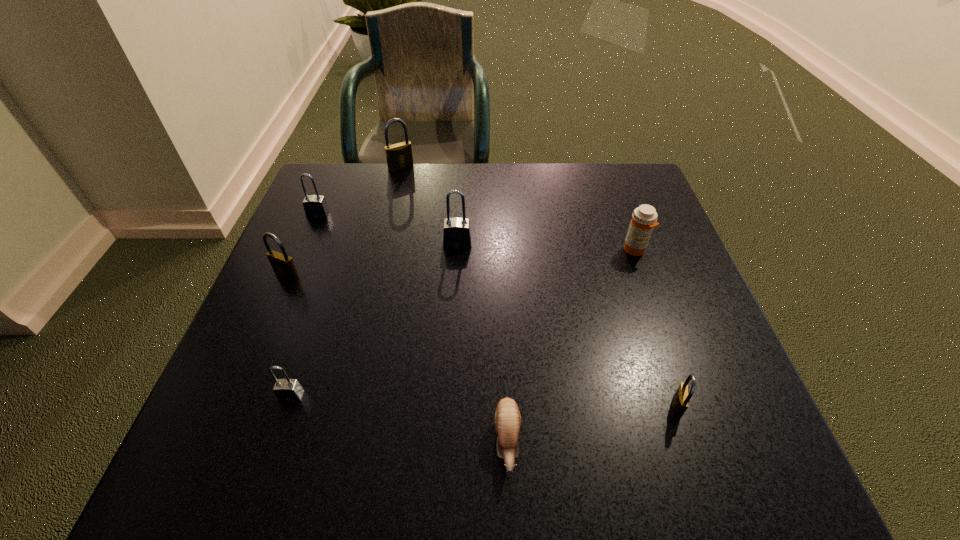
The image size is (960, 540). What are the coordinates of `free location that satisfies the following two spatial constraints: 1. on the shackle of the second farthest object; 2. on the right side of the medicine` in the screenshot? It's located at (303, 250).